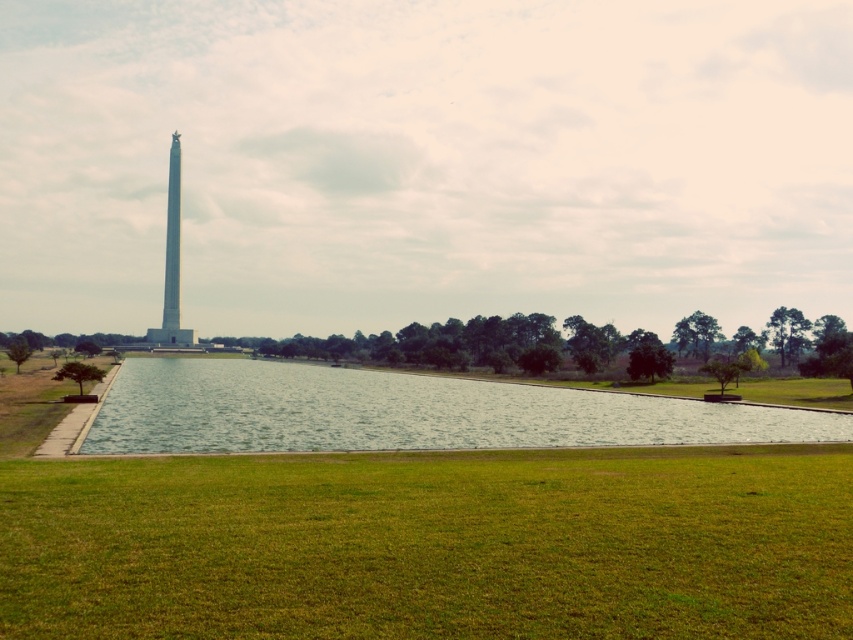
You are standing at the point with coordinates point (x=177, y=278) and want to walk towards the reflecting pool. Will the point point (x=508, y=592) block your path?

Point (x=508, y=592) is in front of point (x=177, y=278), so yes, the point point (x=508, y=592) will block your path.

You are standing at point (431, 545) in the scene. What do you see directly beneath your feet?

You see green grass at lower center directly beneath your feet.